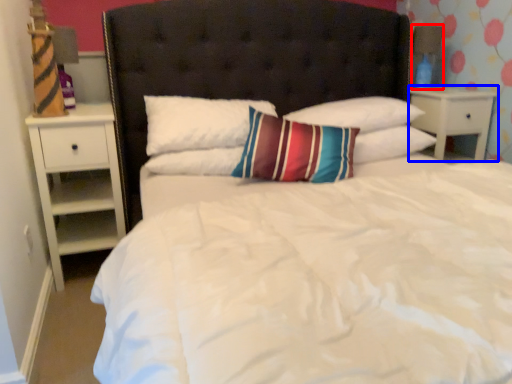
Question: Which of the following is the closest to the observer, lamp (highlighted by a red box) or nightstand (highlighted by a blue box)?

Choices:
 (A) lamp
 (B) nightstand

Answer: (B)